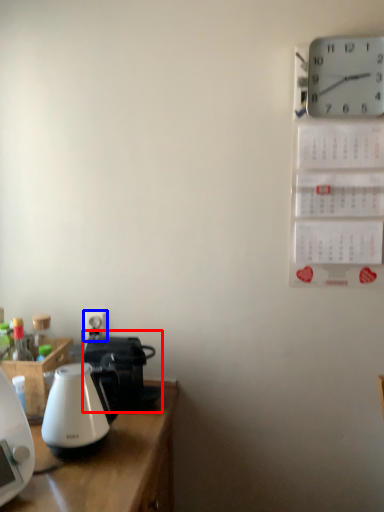
Question: Among these objects, which one is nearest to the camera, coffeepot (highlighted by a red box) or electric outlet (highlighted by a blue box)?

Choices:
 (A) coffeepot
 (B) electric outlet

Answer: (A)